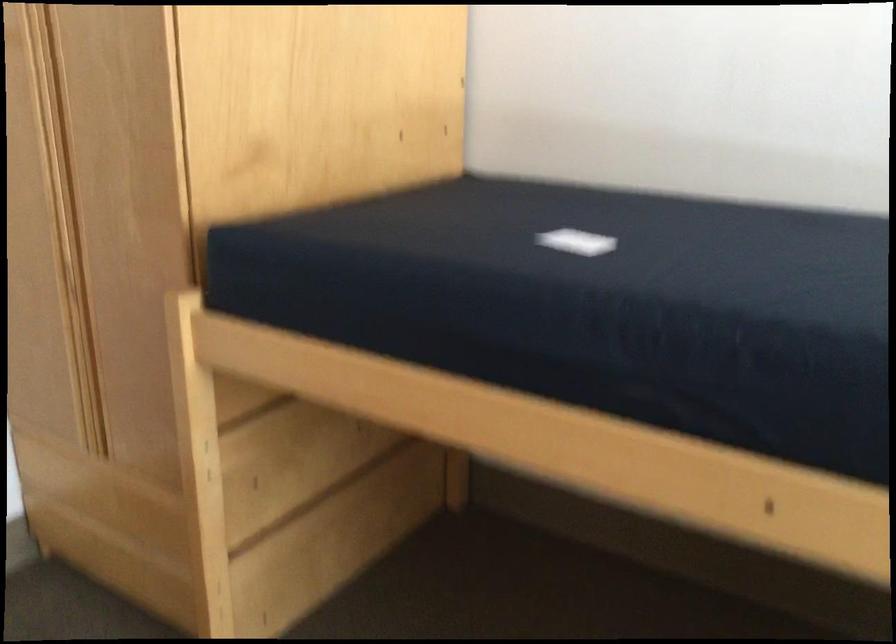
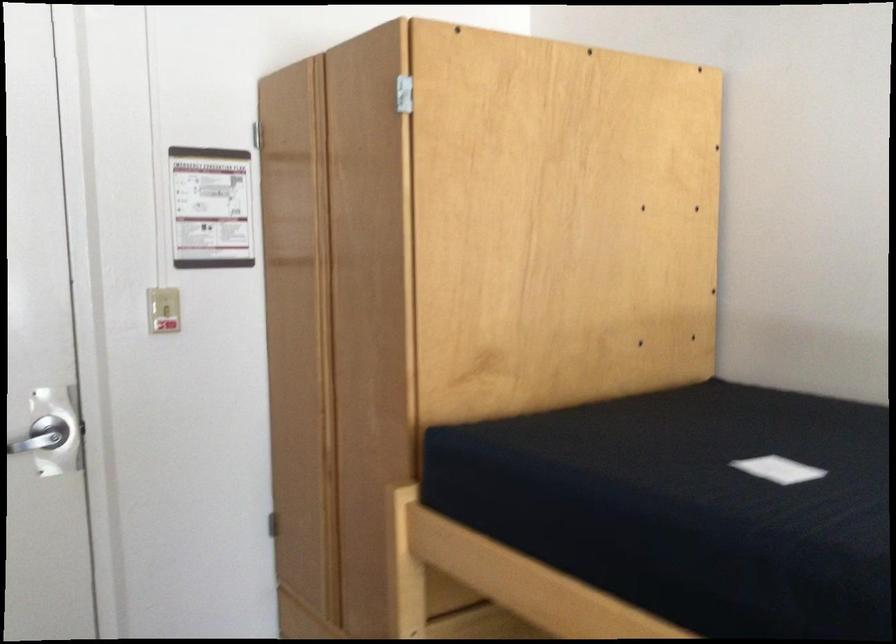
Question: Which direction would the cameraman need to move to produce the second image? Reply with the corresponding letter.

Choices:
 (A) Left
 (B) Right
 (C) Forward
 (D) Backward

Answer: (B)